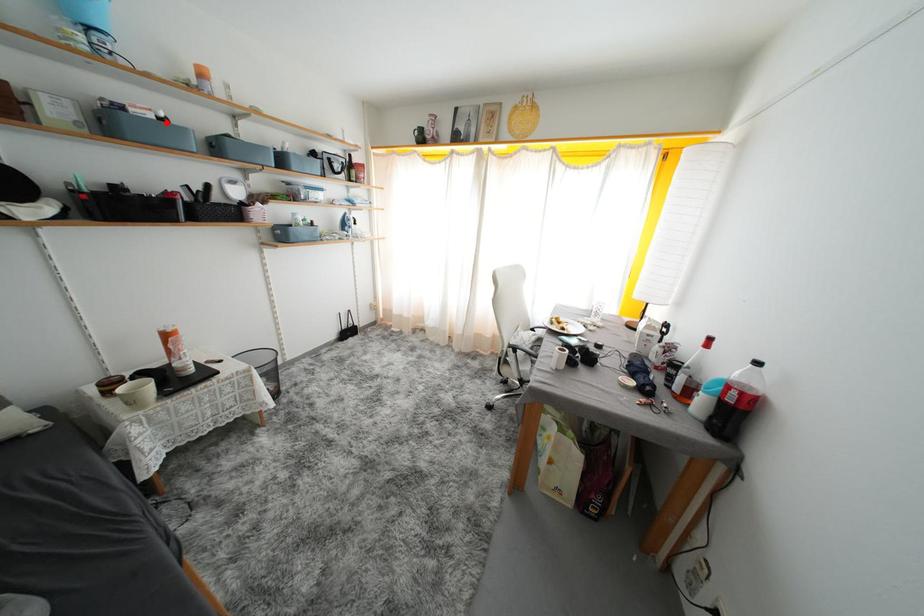
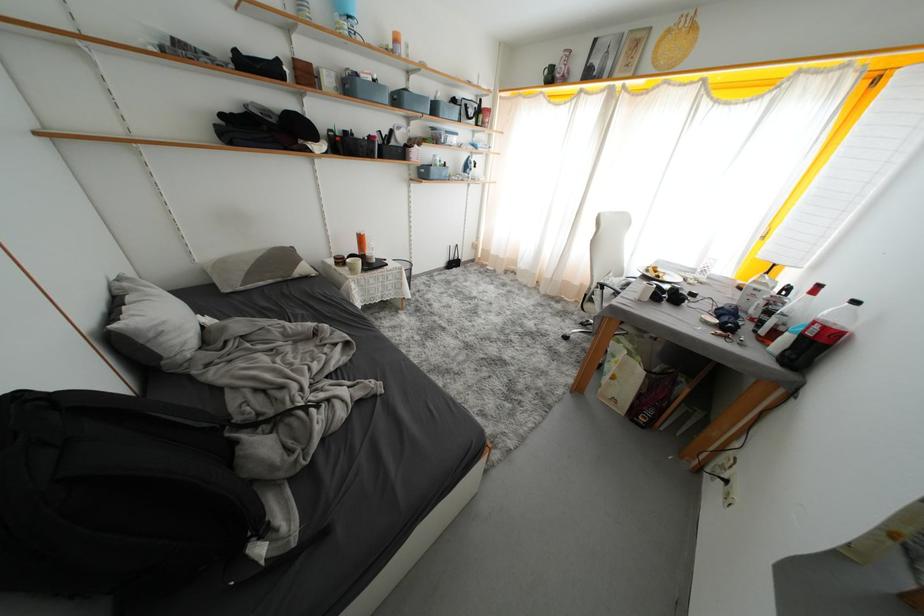
Where in the second image is the point corresponding to the highlighted location from the first image?

(381, 84)